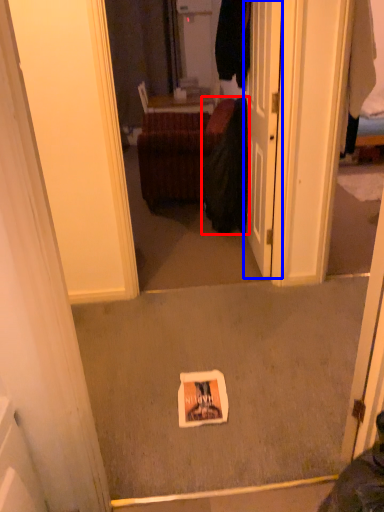
Question: Which of the following is the farthest to the observer, clothing (highlighted by a red box) or door (highlighted by a blue box)?

Choices:
 (A) clothing
 (B) door

Answer: (A)